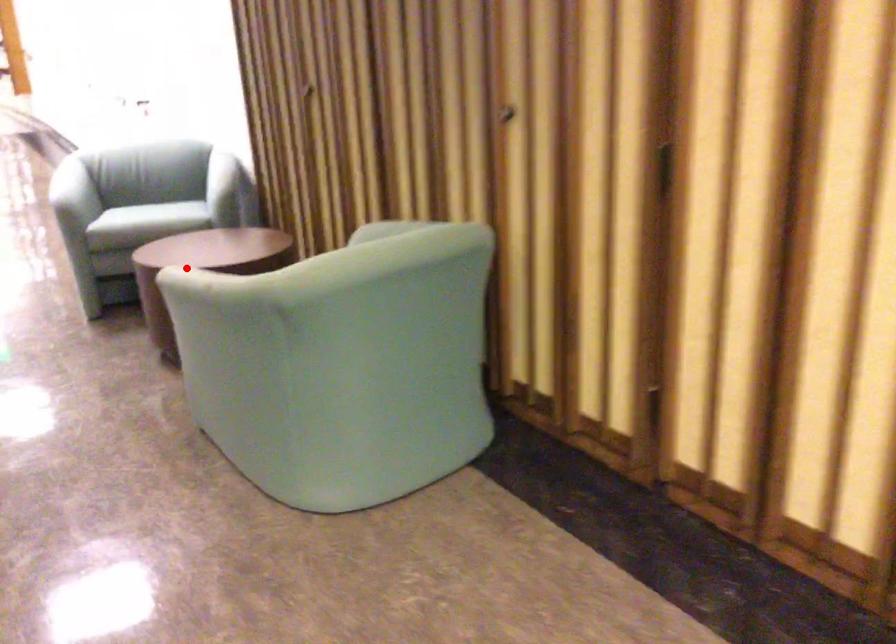
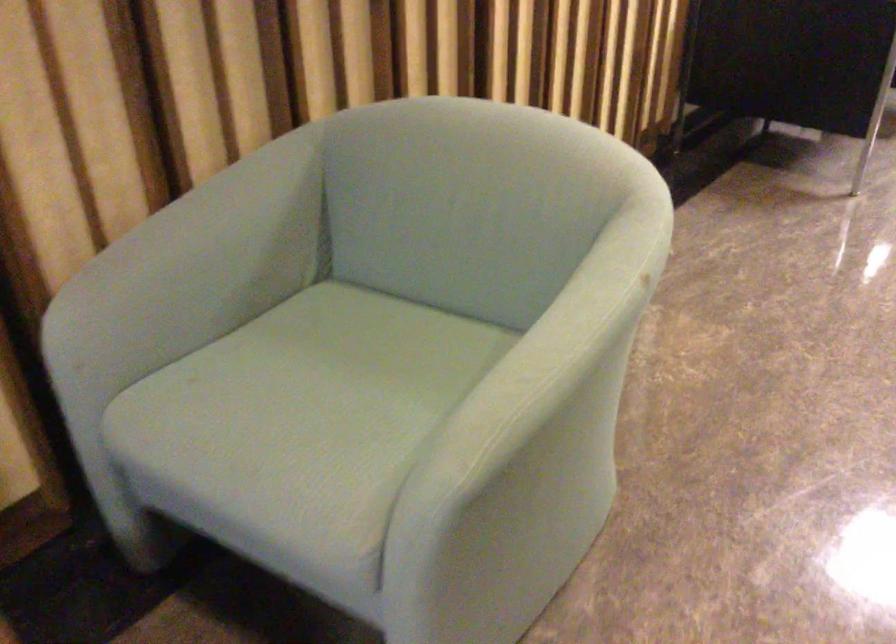
Locate, in the second image, the point that corresponds to the highlighted location in the first image.

(533, 375)